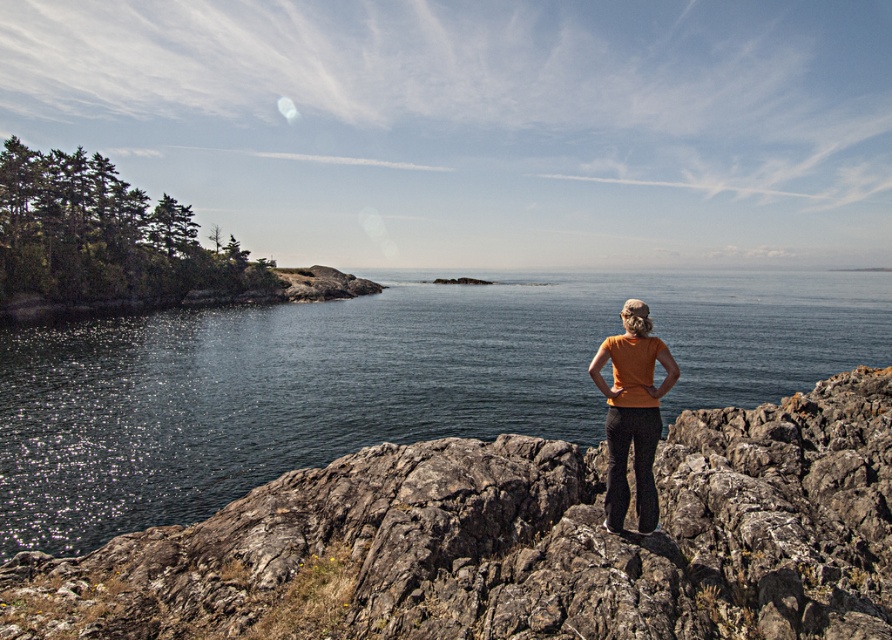
Question: Is rough textured rock at center behind orange cotton shirt at center?

Choices:
 (A) yes
 (B) no

Answer: (B)

Question: Which point is closer to the camera?

Choices:
 (A) (655, 339)
 (B) (555, 541)

Answer: (A)

Question: Which of the following is the farthest from the observer?

Choices:
 (A) (32, 556)
 (B) (636, 300)

Answer: (A)

Question: Does rough textured rock at center have a greater width compared to orange cotton shirt at center?

Choices:
 (A) no
 (B) yes

Answer: (B)

Question: Is rough textured rock at center thinner than orange cotton shirt at center?

Choices:
 (A) yes
 (B) no

Answer: (B)